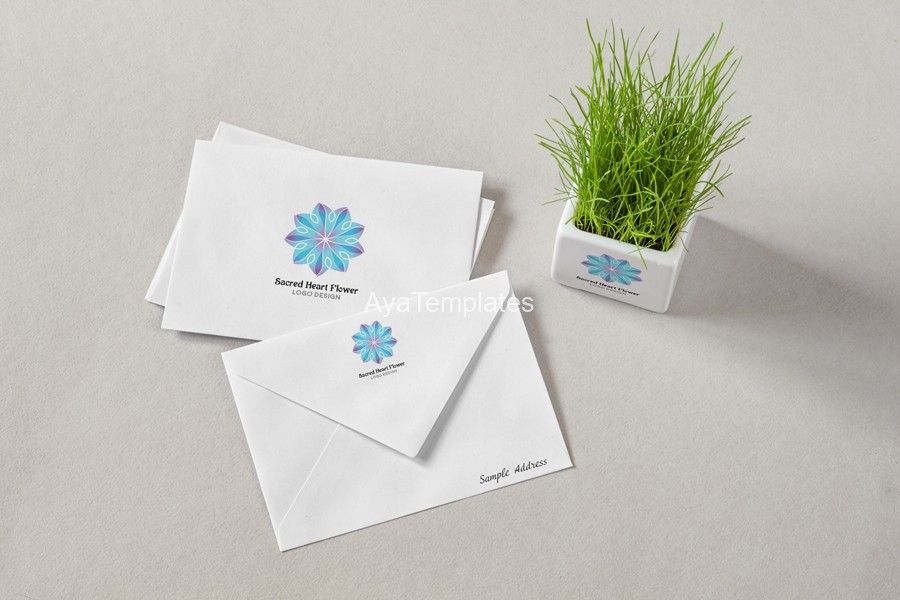
Where is `light grey table`? Image resolution: width=900 pixels, height=600 pixels. light grey table is located at coordinates (466, 104).